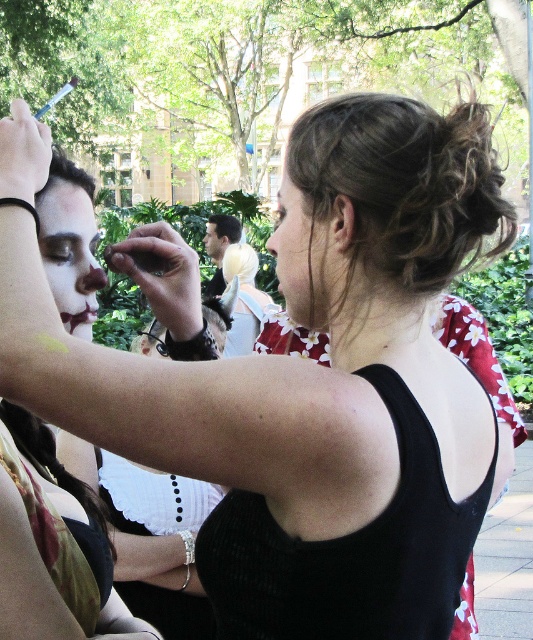
Who is positioned more to the left, white matte face paint at upper left or matte floral dress at center?

white matte face paint at upper left

Is point (92, 257) farther from viewer compared to point (294, 248)?

Yes, it is.

Is point (72, 266) more distant than point (320, 330)?

Yes, point (72, 266) is behind point (320, 330).

The image size is (533, 640). What are the coordinates of `white matte face paint at upper left` in the screenshot? It's located at (69, 253).

Which is behind, point (53, 248) or point (228, 237)?

Point (228, 237)

Is matte white eyebrow at upper left positioned in front of matte white face at center?

Yes, matte white eyebrow at upper left is closer to the viewer.

Locate an element on the screen. matte white eyebrow at upper left is located at coordinates (59, 240).

Based on the photo, does matte floral dress at center come in front of matte white face at center?

Yes, matte floral dress at center is closer to the viewer.

Can you confirm if matte floral dress at center is thinner than matte white face at center?

Correct, matte floral dress at center's width is less than matte white face at center's.

Does point (309, 225) come farther from viewer compared to point (221, 252)?

No, (309, 225) is closer to viewer.

Where is `matte floral dress at center`? matte floral dress at center is located at coordinates (303, 257).